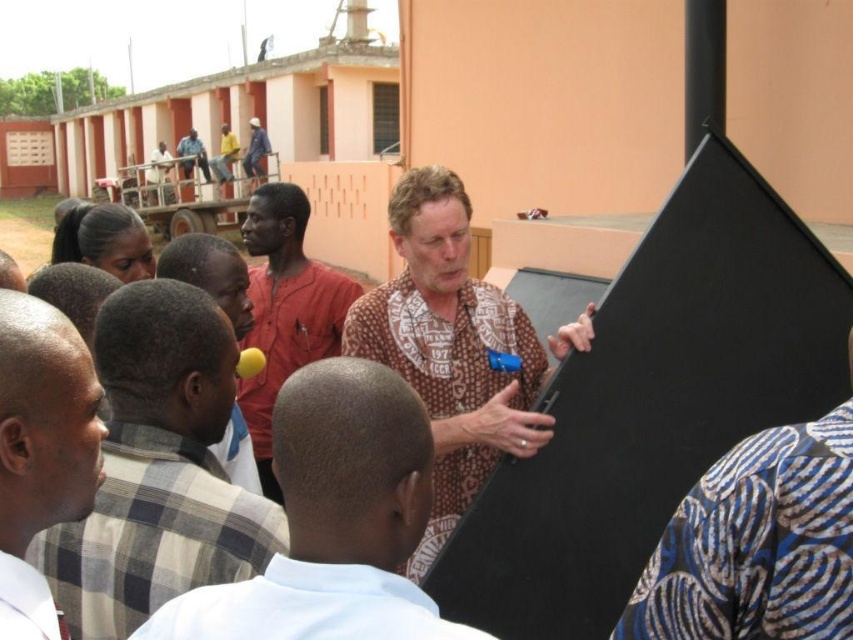
Question: Which object appears farthest from the camera in this image?

Choices:
 (A) white shirt at center
 (B) white checkered shirt at left
 (C) blue fabric shirt at upper center

Answer: (C)

Question: Based on their relative distances, which object is farther from the light brown fabric shirt at center?

Choices:
 (A) smooth black shirt at center
 (B) matte red shirt at center
 (C) white checkered shirt at left

Answer: (B)

Question: Can you confirm if white checkered shirt at left is wider than light brown fabric shirt at center?

Choices:
 (A) no
 (B) yes

Answer: (B)

Question: Is white shirt at center further to the viewer compared to light brown fabric shirt at center?

Choices:
 (A) no
 (B) yes

Answer: (A)

Question: Considering the relative positions of white checkered shirt at left and white shirt at center in the image provided, where is white checkered shirt at left located with respect to white shirt at center?

Choices:
 (A) above
 (B) below

Answer: (A)

Question: Which point appears farthest from the camera in this image?

Choices:
 (A) (384, 465)
 (B) (270, 532)

Answer: (B)